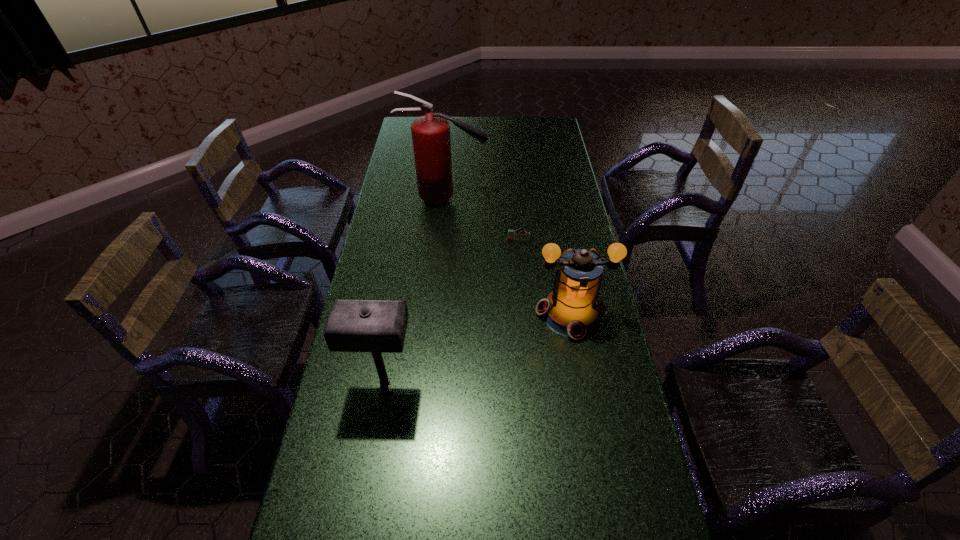
Find the location of `empty space between the stapler and the mallet`. empty space between the stapler and the mallet is located at coordinates (452, 311).

You are a GUI agent. You are given a task and a screenshot of the screen. Output one action in this format:
    pyautogui.click(x=<x>, y=<y>)
    Task: Click on the free space between the farthest object and the nearest object
    The height and width of the screenshot is (540, 960).
    Given the screenshot: What is the action you would take?
    pyautogui.click(x=415, y=290)

Where is `empty space between the lantern and the tallest object`? The width and height of the screenshot is (960, 540). empty space between the lantern and the tallest object is located at coordinates (508, 256).

The image size is (960, 540). Identify the location of free space between the farthest object and the third farthest object. (508, 256).

Image resolution: width=960 pixels, height=540 pixels. In order to click on free space between the nearest object and the third farthest object in this screenshot , I will do pos(477,348).

This screenshot has width=960, height=540. I want to click on vacant space in between the third nearest object and the nearest object, so click(452, 311).

Find the location of a particular element. The image size is (960, 540). free space between the stapler and the mallet is located at coordinates (452, 311).

Identify the location of object that is the closest to the stapler. pos(431,141).

The width and height of the screenshot is (960, 540). What are the coordinates of `object that can be found as the second closest to the farthest object` in the screenshot? It's located at [573, 308].

Where is `vacant space that satisfies the following two spatial constraints: 1. on the handle side of the second farthest object; 2. on the front side of the second tallest object`? The width and height of the screenshot is (960, 540). vacant space that satisfies the following two spatial constraints: 1. on the handle side of the second farthest object; 2. on the front side of the second tallest object is located at coordinates (533, 382).